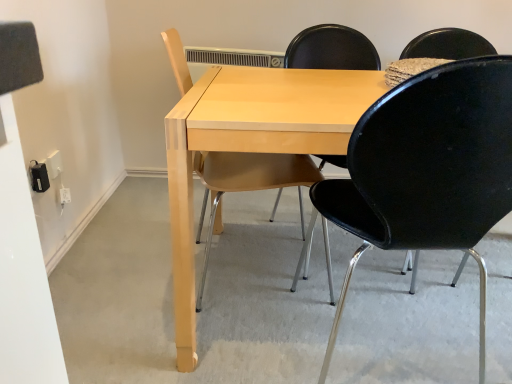
Describe the element at coordinates (251, 144) in the screenshot. The image size is (512, 384). I see `light wood table at center` at that location.

Locate an element on the screen. The height and width of the screenshot is (384, 512). black plastic chair at center, which is counted as the first chair, starting from the right is located at coordinates (428, 168).

You are a GUI agent. You are given a task and a screenshot of the screen. Output one action in this format:
    pyautogui.click(x=<x>, y=<y>)
    Task: Click on the light wood table at center
    
    Given the screenshot: What is the action you would take?
    251,144

From the picture: From a real-world perspective, between light wood table at center and black plastic chair at center, positioned as the 2th chair in left-to-right order, who is vertically higher?

black plastic chair at center, positioned as the 2th chair in left-to-right order.

Considering their positions, is light wood table at center located in front of or behind black plastic chair at center, which is counted as the first chair, starting from the right?

Visually, light wood table at center is located behind black plastic chair at center, which is counted as the first chair, starting from the right.

Considering the relative sizes of light wood table at center and black plastic chair at center, positioned as the 2th chair in left-to-right order, in the image provided, is light wood table at center wider than black plastic chair at center, positioned as the 2th chair in left-to-right order,?

Indeed, light wood table at center has a greater width compared to black plastic chair at center, positioned as the 2th chair in left-to-right order.

Considering the sizes of objects light wood table at center and black plastic chair at center, positioned as the 2th chair in left-to-right order, in the image provided, who is bigger, light wood table at center or black plastic chair at center, positioned as the 2th chair in left-to-right order,?

Bigger between the two is light wood table at center.

Does black plastic chair at center, positioned as the 2th chair in left-to-right order, turn towards light wood table at center?

Yes, black plastic chair at center, positioned as the 2th chair in left-to-right order, is aimed at light wood table at center.

In the scene shown: Considering the positions of objects black plastic chair at center, which is counted as the first chair, starting from the right, and light wood table at center in the image provided, who is more to the right, black plastic chair at center, which is counted as the first chair, starting from the right, or light wood table at center?

Positioned to the right is black plastic chair at center, which is counted as the first chair, starting from the right.

Can you confirm if black plastic chair at center, positioned as the 2th chair in left-to-right order, is thinner than light wood table at center?

Indeed, black plastic chair at center, positioned as the 2th chair in left-to-right order, has a lesser width compared to light wood table at center.

Can you confirm if black plastic chair at center, which is counted as the first chair, starting from the right, is taller than light wood table at center?

Correct, black plastic chair at center, which is counted as the first chair, starting from the right, is much taller as light wood table at center.

Visually, is light wood chair at center, which appears as the 1th chair when viewed from the left, positioned to the left or to the right of black plastic chair at center, which is counted as the first chair, starting from the right?

light wood chair at center, which appears as the 1th chair when viewed from the left, is positioned on black plastic chair at center, which is counted as the first chair, starting from the right,'s left side.

Is light wood chair at center, which appears as the 1th chair when viewed from the left, bigger than black plastic chair at center, positioned as the 2th chair in left-to-right order?

No, light wood chair at center, which appears as the 1th chair when viewed from the left, is not bigger than black plastic chair at center, positioned as the 2th chair in left-to-right order.

In the scene shown: Which of these two, light wood chair at center, the 2th chair positioned from the right, or black plastic chair at center, which is counted as the first chair, starting from the right, stands taller?

Standing taller between the two is light wood chair at center, the 2th chair positioned from the right.

From a real-world perspective, which object rests below the other?

light wood chair at center, which appears as the 1th chair when viewed from the left, from a real-world perspective.

Which is closer, (315, 169) or (292, 131)?

The point (292, 131) is closer to the camera.

From the image's perspective, which one is positioned lower, light wood chair at center, which appears as the 1th chair when viewed from the left, or light wood table at center?

light wood table at center, from the image's perspective.

In the scene shown: Visually, is light wood chair at center, the 2th chair positioned from the right, positioned to the left or to the right of light wood table at center?

light wood chair at center, the 2th chair positioned from the right, is positioned on light wood table at center's left side.

In terms of height, does light wood chair at center, which appears as the 1th chair when viewed from the left, look taller or shorter compared to light wood table at center?

Clearly, light wood chair at center, which appears as the 1th chair when viewed from the left, is taller compared to light wood table at center.

From a real-world perspective, which is physically below, light wood table at center or light wood chair at center, the 2th chair positioned from the right?

From a 3D spatial view, light wood table at center is below.

Would you consider light wood table at center to be distant from light wood chair at center, which appears as the 1th chair when viewed from the left?

No, light wood table at center is not far from light wood chair at center, which appears as the 1th chair when viewed from the left.

Between light wood table at center and light wood chair at center, the 2th chair positioned from the right, which one has more height?

Standing taller between the two is light wood chair at center, the 2th chair positioned from the right.

Is black plastic chair at center, positioned as the 2th chair in left-to-right order, bigger or smaller than light wood chair at center, which appears as the 1th chair when viewed from the left?

Considering their sizes, black plastic chair at center, positioned as the 2th chair in left-to-right order, takes up more space than light wood chair at center, which appears as the 1th chair when viewed from the left.

The height and width of the screenshot is (384, 512). What are the coordinates of `chair positioned vertically above the light wood chair at center, the 2th chair positioned from the right (from a real-world perspective)` in the screenshot? It's located at (428, 168).

Which object is closer to the camera taking this photo, black plastic chair at center, which is counted as the first chair, starting from the right, or light wood chair at center, the 2th chair positioned from the right?

black plastic chair at center, which is counted as the first chair, starting from the right, is more forward.

The height and width of the screenshot is (384, 512). Find the location of `table that appears behind the black plastic chair at center, which is counted as the first chair, starting from the right`. table that appears behind the black plastic chair at center, which is counted as the first chair, starting from the right is located at coordinates tap(251, 144).

The height and width of the screenshot is (384, 512). What are the coordinates of `table above the black plastic chair at center, positioned as the 2th chair in left-to-right order (from the image's perspective)` in the screenshot? It's located at (251, 144).

Considering their positions, is black plastic chair at center, positioned as the 2th chair in left-to-right order, positioned closer to light wood chair at center, the 2th chair positioned from the right, than light wood table at center?

light wood table at center is closer to light wood chair at center, the 2th chair positioned from the right.

Estimate the real-world distances between objects in this image. Which object is closer to black plastic chair at center, which is counted as the first chair, starting from the right, light wood chair at center, which appears as the 1th chair when viewed from the left, or light wood table at center?

light wood table at center is closer to black plastic chair at center, which is counted as the first chair, starting from the right.

Based on their spatial positions, is black plastic chair at center, which is counted as the first chair, starting from the right, or light wood chair at center, the 2th chair positioned from the right, closer to light wood table at center?

light wood chair at center, the 2th chair positioned from the right, is positioned closer to the anchor light wood table at center.

Which object lies nearer to the anchor point light wood table at center, light wood chair at center, which appears as the 1th chair when viewed from the left, or black plastic chair at center, positioned as the 2th chair in left-to-right order?

Based on the image, light wood chair at center, which appears as the 1th chair when viewed from the left, appears to be nearer to light wood table at center.

Estimate the real-world distances between objects in this image. Which object is closer to light wood chair at center, which appears as the 1th chair when viewed from the left, light wood table at center or black plastic chair at center, which is counted as the first chair, starting from the right?

light wood table at center is closer to light wood chair at center, which appears as the 1th chair when viewed from the left.

Which object lies nearer to the anchor point black plastic chair at center, positioned as the 2th chair in left-to-right order, light wood table at center or light wood chair at center, the 2th chair positioned from the right?

Based on the image, light wood table at center appears to be nearer to black plastic chair at center, positioned as the 2th chair in left-to-right order.

I want to click on table between light wood chair at center, which appears as the 1th chair when viewed from the left, and black plastic chair at center, which is counted as the first chair, starting from the right, from left to right, so click(251, 144).